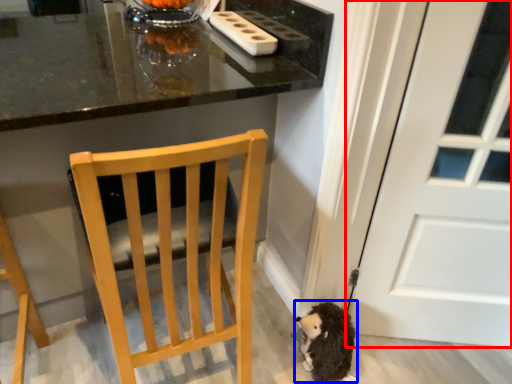
Question: Which object appears farthest to the camera in this image, door (highlighted by a red box) or toy (highlighted by a blue box)?

Choices:
 (A) door
 (B) toy

Answer: (B)